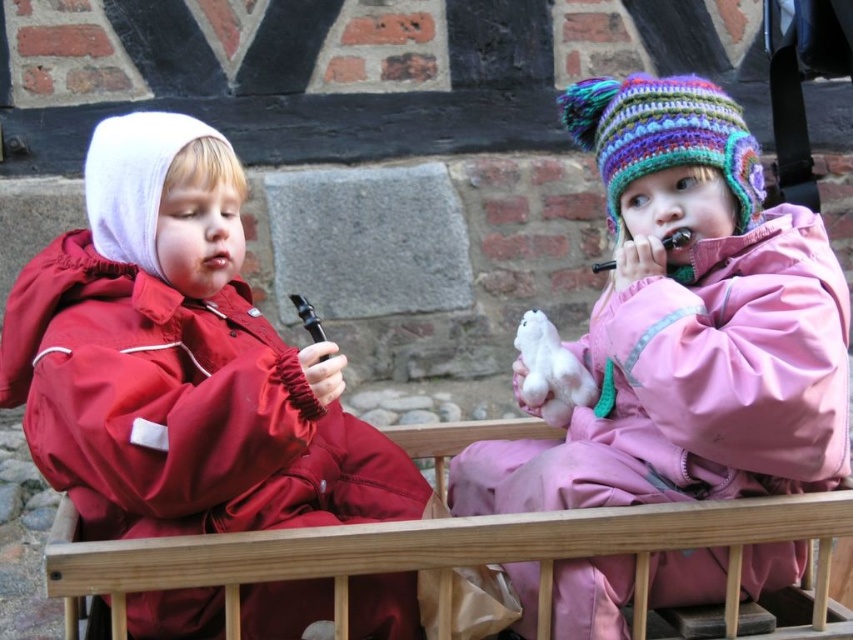
You are a photographer trying to capture a closeup shot of the child on the left. You have a camera with a focus point at point (78, 509). There is another point at (529, 362). Which point should you use to ensure the child on the left is in focus?

You should use point (78, 509) because it is closer to the viewer, ensuring the child on the left is in focus.

You are a photographer trying to capture a closeup shot of the white plush toy at center and the matte pink lips at center. Since you want to focus on the taller object, which one should you adjust your camera to focus on?

The white plush toy at center is taller than the matte pink lips at center, so you should adjust your camera to focus on the white plush toy at center.